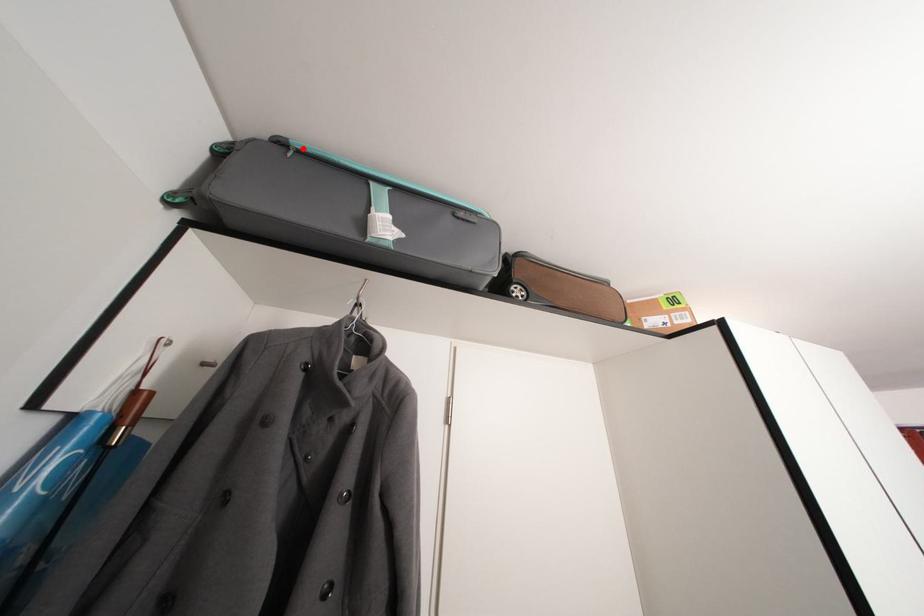
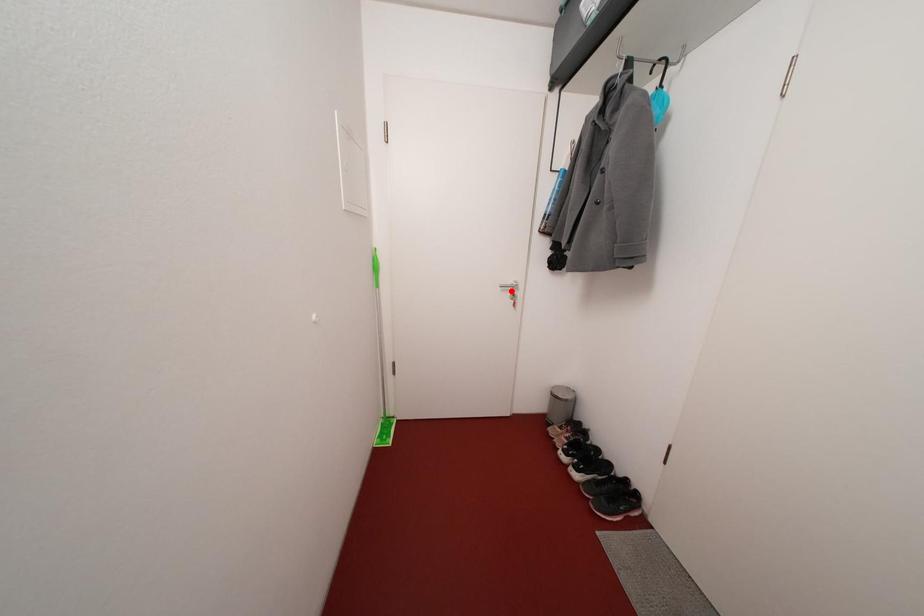
I am providing you with two images of the same scene from different viewpoints. A red point is marked on the first image and another point is marked on the second image. Is the red point in image1 aligned with the point shown in image2?

No